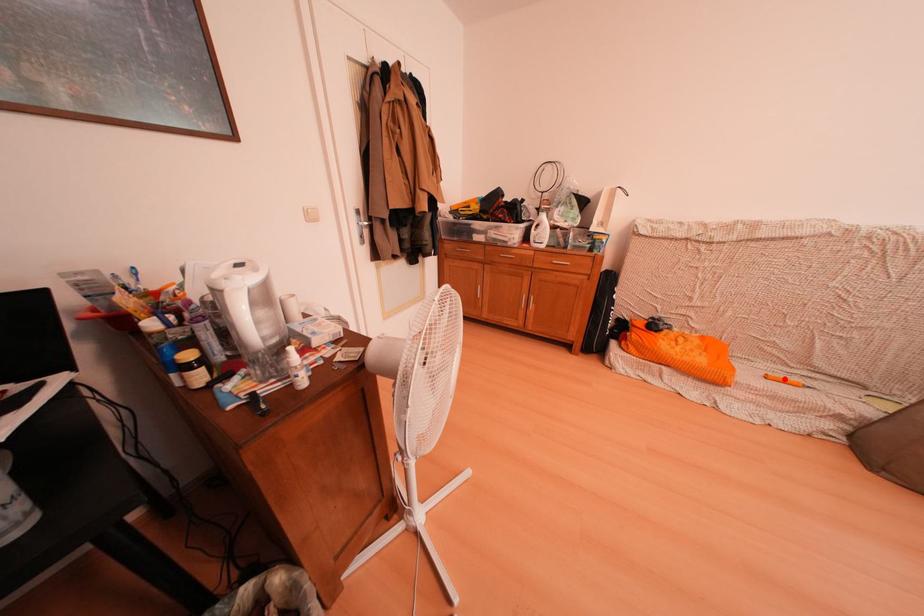
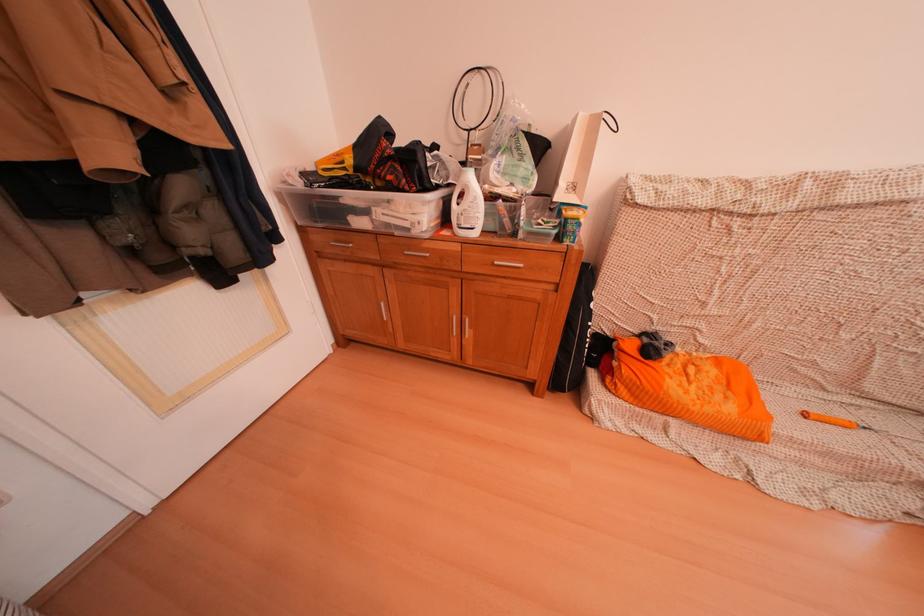
The point at the highlighted location is marked in the first image. Where is the corresponding point in the second image?

(824, 415)